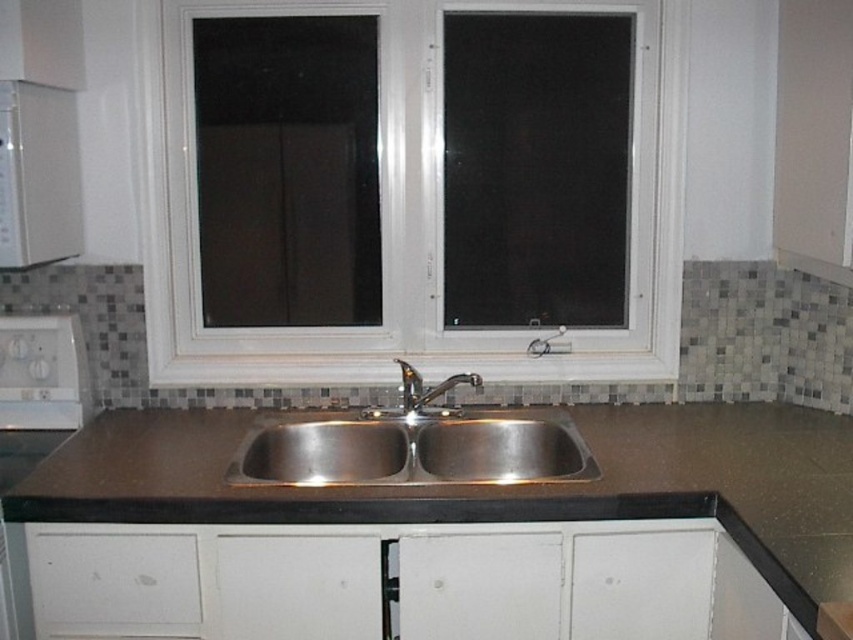
You are a person standing in the kitchen and want to place a 3.5 feet long cutting board on the brown laminate countertop at center. Can you fit it there?

The brown laminate countertop at center is 4.26 feet away from viewer, so the distance between you and the countertop is sufficient to place a 3.5 feet long cutting board.

You are a kitchen designer trying to place a new appliance next to the white glossy dishwasher at lower left and the polished stainless steel faucet at center. Considering their sizes, which one would require more space for placement?

The white glossy dishwasher at lower left requires more space for placement since it is larger in size than the polished stainless steel faucet at center.

You are a kitchen designer and need to ensure that the white glossy dishwasher at lower left and the polished stainless steel faucet at center fit within a 1.2 meter wide space. Given their widths, can both appliances be placed side by side without exceeding the space?

The white glossy dishwasher at lower left is wider than the polished stainless steel faucet at center. However, without knowing their exact widths, it is impossible to determine if their combined width exceeds 1.2 meters. More information is needed.